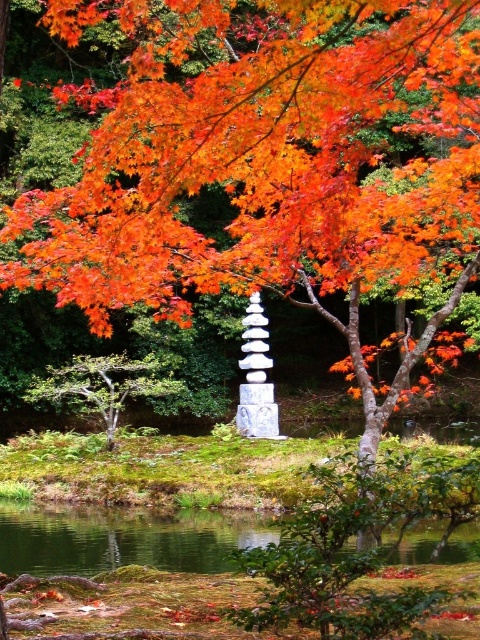
In the scene shown: Is green reflective water at lower center above white stone pillar at center?

No.

Is point (252, 515) less distant than point (264, 372)?

Yes, point (252, 515) is in front of point (264, 372).

Who is more distant from viewer, (427, 560) or (248, 428)?

The point (248, 428) is more distant.

The width and height of the screenshot is (480, 640). What are the coordinates of `green reflective water at lower center` in the screenshot? It's located at (122, 538).

Locate an element on the screen. The image size is (480, 640). green reflective water at lower center is located at coordinates (122, 538).

Who is lower down, green reflective water at lower center or green matte tree at lower left?

green reflective water at lower center is below.

The width and height of the screenshot is (480, 640). Describe the element at coordinates (122, 538) in the screenshot. I see `green reflective water at lower center` at that location.

Locate an element on the screen. green reflective water at lower center is located at coordinates (122, 538).

Does shiny orange maple at upper center lie behind white stone pillar at center?

No, it is not.

This screenshot has width=480, height=640. In order to click on shiny orange maple at upper center in this screenshot , I will do `click(263, 154)`.